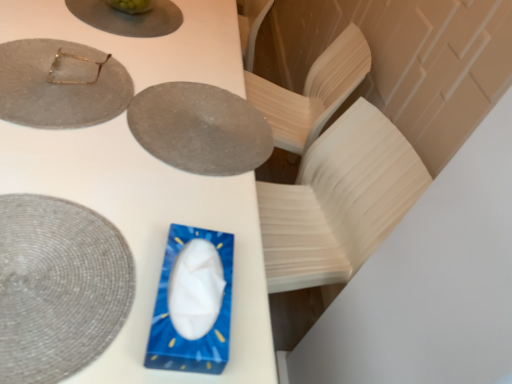
Locate an element on the screen. vacant space underneath matte gray plate at upper center, placed as the third plate when sorted from top to bottom (from a real-world perspective) is located at coordinates (199, 121).